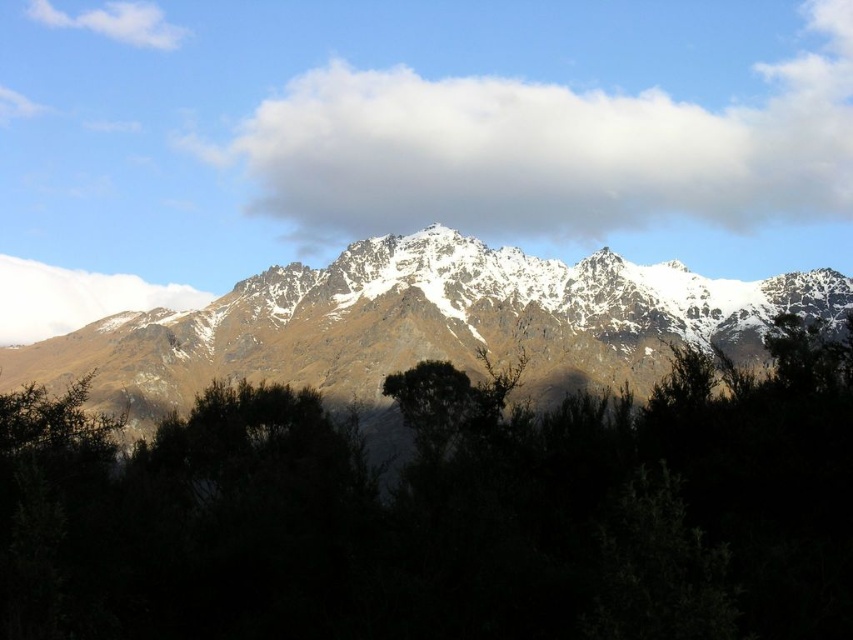
Question: Can you confirm if snowy rocky mountain range at center is positioned above white fluffy cloud at upper left?

Choices:
 (A) yes
 (B) no

Answer: (B)

Question: Is brown textured tree at center above snowy rocky mountain range at center?

Choices:
 (A) no
 (B) yes

Answer: (A)

Question: Which point appears closest to the camera in this image?

Choices:
 (A) (805, 296)
 (B) (158, 19)
 (C) (74, 321)
 (D) (328, 225)

Answer: (A)

Question: Is brown textured tree at center below snowy rocky mountain range at center?

Choices:
 (A) no
 (B) yes

Answer: (B)

Question: Among these points, which one is nearest to the camera?

Choices:
 (A) (143, 6)
 (B) (128, 301)
 (C) (807, 84)
 (D) (357, 259)

Answer: (D)

Question: Which point is closer to the camera?

Choices:
 (A) (461, 180)
 (B) (22, 342)

Answer: (B)